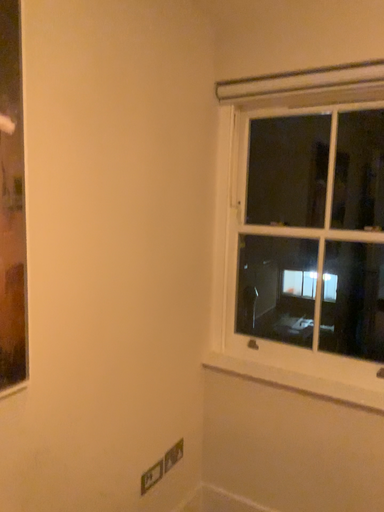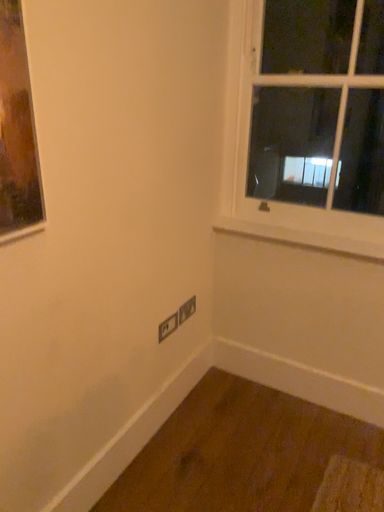
Question: Which way did the camera rotate in the video?

Choices:
 (A) rotated upward
 (B) rotated downward

Answer: (B)